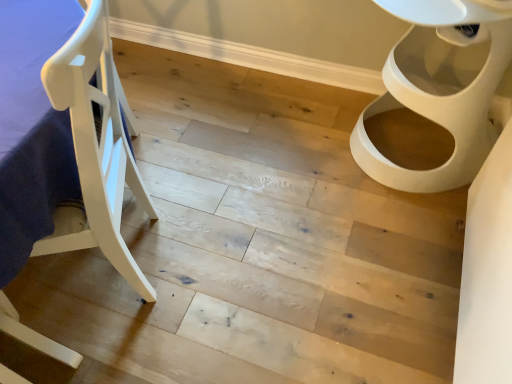
Question: Considering the positions of point (502, 4) and point (95, 235), is point (502, 4) closer or farther from the camera than point (95, 235)?

Choices:
 (A) closer
 (B) farther

Answer: (B)

Question: Based on their sizes in the image, would you say white glossy toilet at right is bigger or smaller than white wood chair at left?

Choices:
 (A) small
 (B) big

Answer: (A)

Question: Is white glossy toilet at right spatially inside white wood chair at left, or outside of it?

Choices:
 (A) outside
 (B) inside

Answer: (A)

Question: Is point (58, 87) closer or farther from the camera than point (415, 67)?

Choices:
 (A) closer
 (B) farther

Answer: (A)

Question: Is white wood chair at left taller or shorter than white glossy toilet at right?

Choices:
 (A) tall
 (B) short

Answer: (A)

Question: In the image, is white wood chair at left positioned in front of or behind white glossy toilet at right?

Choices:
 (A) behind
 (B) front

Answer: (B)

Question: Considering the relative positions of white wood chair at left and white glossy toilet at right in the image provided, is white wood chair at left to the left or to the right of white glossy toilet at right?

Choices:
 (A) left
 (B) right

Answer: (A)